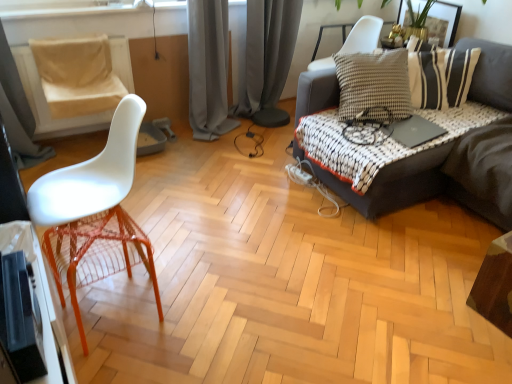
Where is `vacant space situated on the left part of wooden table at lower right`? vacant space situated on the left part of wooden table at lower right is located at coordinates tap(448, 307).